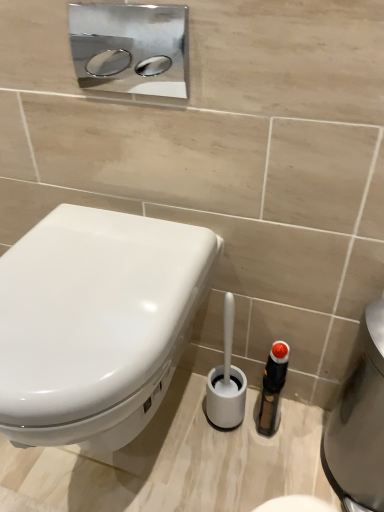
Question: From the image's perspective, is white plastic toilet brush at lower center under silver metallic water heater at lower right?

Choices:
 (A) yes
 (B) no

Answer: (B)

Question: Can you confirm if white plastic toilet brush at lower center is smaller than silver metallic water heater at lower right?

Choices:
 (A) yes
 (B) no

Answer: (A)

Question: Considering the relative positions of white plastic toilet brush at lower center and silver metallic water heater at lower right in the image provided, is white plastic toilet brush at lower center to the left of silver metallic water heater at lower right from the viewer's perspective?

Choices:
 (A) yes
 (B) no

Answer: (A)

Question: Does white plastic toilet brush at lower center come behind silver metallic water heater at lower right?

Choices:
 (A) yes
 (B) no

Answer: (A)

Question: From a real-world perspective, is white plastic toilet brush at lower center on top of silver metallic water heater at lower right?

Choices:
 (A) no
 (B) yes

Answer: (A)

Question: From a real-world perspective, is white plastic toilet brush at lower center located beneath silver metallic water heater at lower right?

Choices:
 (A) no
 (B) yes

Answer: (B)

Question: From a real-world perspective, is silver metallic water heater at lower right on top of white plastic toilet brush at lower center?

Choices:
 (A) yes
 (B) no

Answer: (A)

Question: Does silver metallic water heater at lower right have a larger size compared to white plastic toilet brush at lower center?

Choices:
 (A) yes
 (B) no

Answer: (A)

Question: Can you confirm if silver metallic water heater at lower right is wider than white plastic toilet brush at lower center?

Choices:
 (A) no
 (B) yes

Answer: (B)

Question: Would you say silver metallic water heater at lower right is a long distance from white plastic toilet brush at lower center?

Choices:
 (A) yes
 (B) no

Answer: (B)

Question: Is silver metallic water heater at lower right in front of white plastic toilet brush at lower center?

Choices:
 (A) no
 (B) yes

Answer: (B)

Question: Would you say white plastic toilet brush at lower center is part of silver metallic water heater at lower right's contents?

Choices:
 (A) yes
 (B) no

Answer: (B)

Question: Would you say white glossy toilet at left is part of silver metallic water heater at lower right's contents?

Choices:
 (A) no
 (B) yes

Answer: (A)